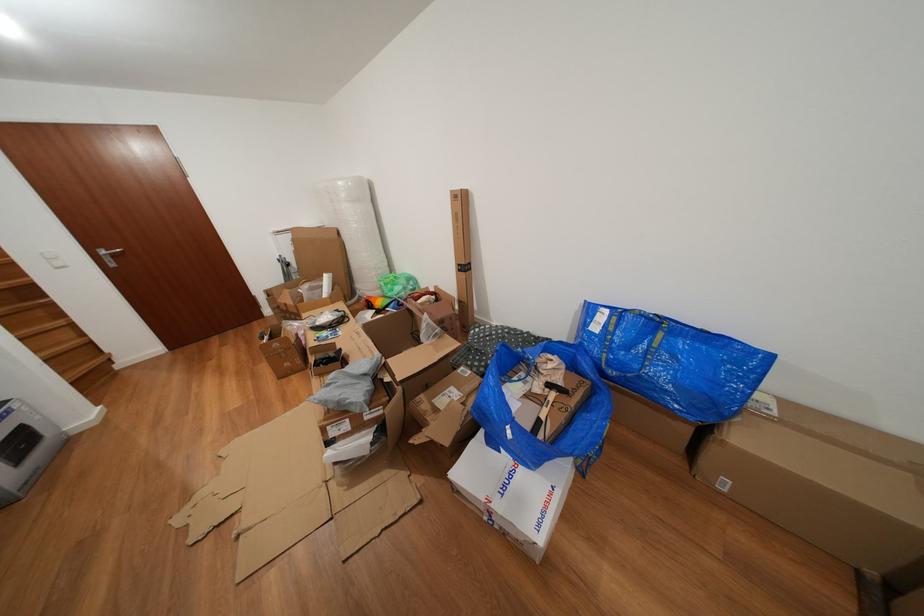
Image resolution: width=924 pixels, height=616 pixels. Identify the location of silver door handle. (108, 254).